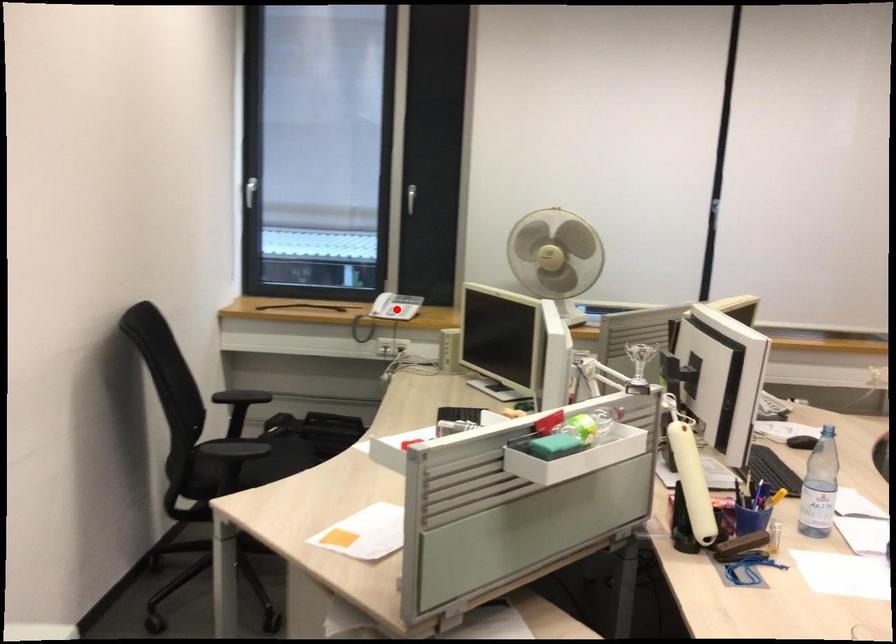
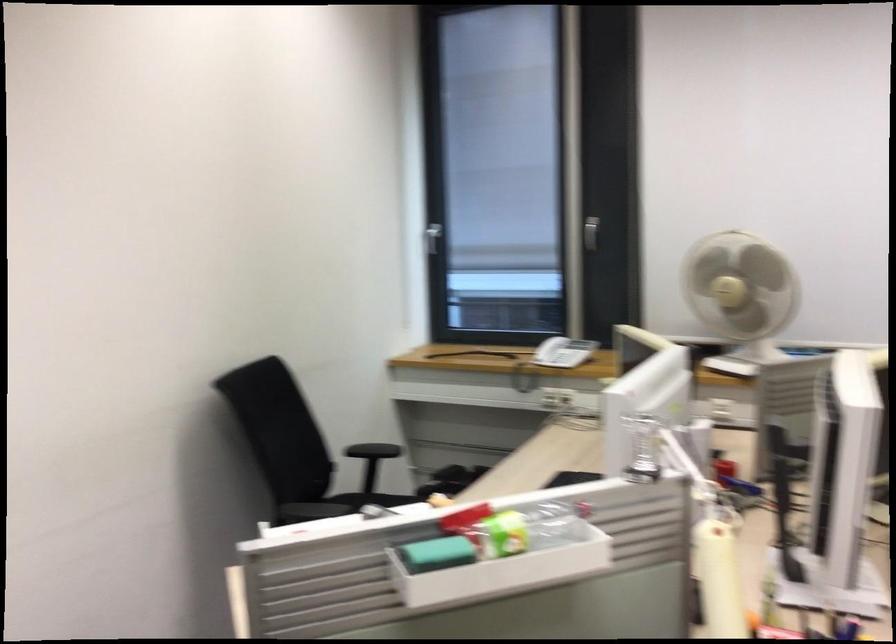
Where in the second image is the point corresponding to the highlighted location from the first image?

(563, 352)